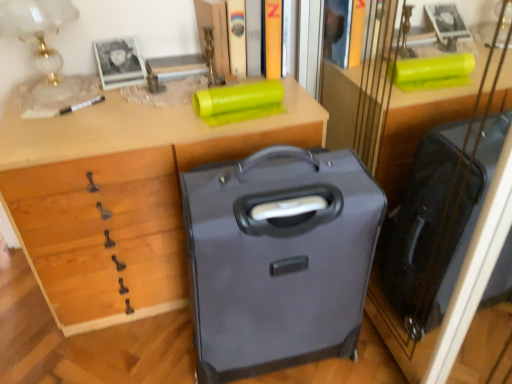
Question: Should I look upward or downward to see matte plastic book at upper center, positioned as the first book in left-to-right order?

Choices:
 (A) up
 (B) down

Answer: (A)

Question: Would you say matte glass table lamp at upper left is a long distance from matte plastic book at upper center, the 2th book from the right?

Choices:
 (A) no
 (B) yes

Answer: (A)

Question: Does matte glass table lamp at upper left have a lesser height compared to matte plastic book at upper center, positioned as the first book in left-to-right order?

Choices:
 (A) yes
 (B) no

Answer: (B)

Question: Is matte glass table lamp at upper left bigger than matte plastic book at upper center, positioned as the first book in left-to-right order?

Choices:
 (A) yes
 (B) no

Answer: (A)

Question: From a real-world perspective, is matte glass table lamp at upper left over matte plastic book at upper center, the 2th book from the right?

Choices:
 (A) yes
 (B) no

Answer: (A)

Question: Does matte glass table lamp at upper left have a greater width compared to matte plastic book at upper center, positioned as the first book in left-to-right order?

Choices:
 (A) no
 (B) yes

Answer: (B)

Question: Does matte glass table lamp at upper left lie in front of matte plastic book at upper center, the 2th book from the right?

Choices:
 (A) yes
 (B) no

Answer: (A)

Question: Is matte plastic book at upper center, the 2th book from the right, oriented towards matte gray suitcase at center?

Choices:
 (A) no
 (B) yes

Answer: (B)

Question: Could matte gray suitcase at center be considered to be inside matte plastic book at upper center, positioned as the first book in left-to-right order?

Choices:
 (A) yes
 (B) no

Answer: (B)

Question: Does matte plastic book at upper center, positioned as the first book in left-to-right order, have a lesser width compared to matte gray suitcase at center?

Choices:
 (A) yes
 (B) no

Answer: (A)

Question: From the image's perspective, is matte plastic book at upper center, the 2th book from the right, on matte gray suitcase at center?

Choices:
 (A) no
 (B) yes

Answer: (B)

Question: Can you confirm if matte plastic book at upper center, positioned as the first book in left-to-right order, is bigger than matte gray suitcase at center?

Choices:
 (A) yes
 (B) no

Answer: (B)

Question: From the image's perspective, is matte plastic book at upper center, positioned as the first book in left-to-right order, below matte gray suitcase at center?

Choices:
 (A) yes
 (B) no

Answer: (B)

Question: Is the position of matte gray suitcase at center less distant than that of hardcover book at upper center, arranged as the second book when viewed from the left?

Choices:
 (A) no
 (B) yes

Answer: (B)